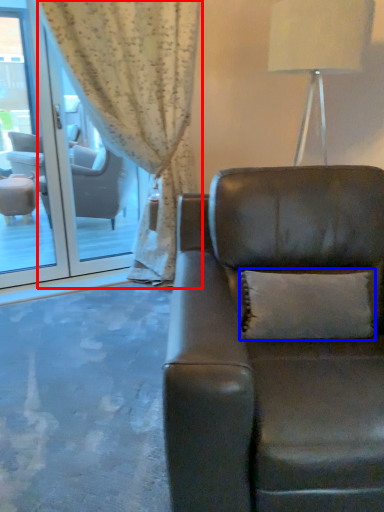
Question: Among these objects, which one is nearest to the camera, curtain (highlighted by a red box) or pillow (highlighted by a blue box)?

Choices:
 (A) curtain
 (B) pillow

Answer: (B)